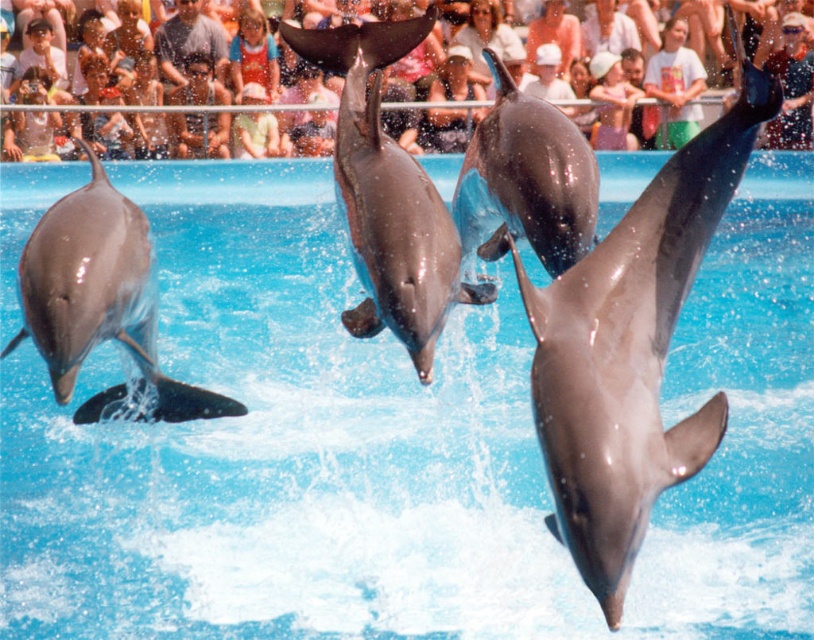
Question: Observing the image, what is the correct spatial positioning of white t-shirt at upper center in reference to white cotton cap at upper center?

Choices:
 (A) right
 (B) left

Answer: (A)

Question: Is white t-shirt at upper center smaller than smooth skin face at upper center?

Choices:
 (A) yes
 (B) no

Answer: (B)

Question: Which point is farther from the camera taking this photo?

Choices:
 (A) (677, 131)
 (B) (703, 252)

Answer: (A)

Question: Is smooth gray dolphin at left thinner than light blue denim shirt at upper center?

Choices:
 (A) yes
 (B) no

Answer: (B)

Question: Which object is positioned farthest from the matte plastic crowd at upper center?

Choices:
 (A) light blue denim shirt at upper center
 (B) white t-shirt at upper center

Answer: (A)

Question: Which object is the closest to the white t-shirt at upper center?

Choices:
 (A) light blue denim jacket at upper center
 (B) glossy gray dolphin at center
 (C) white cotton cap at upper center
 (D) white cotton hat at upper center

Answer: (C)